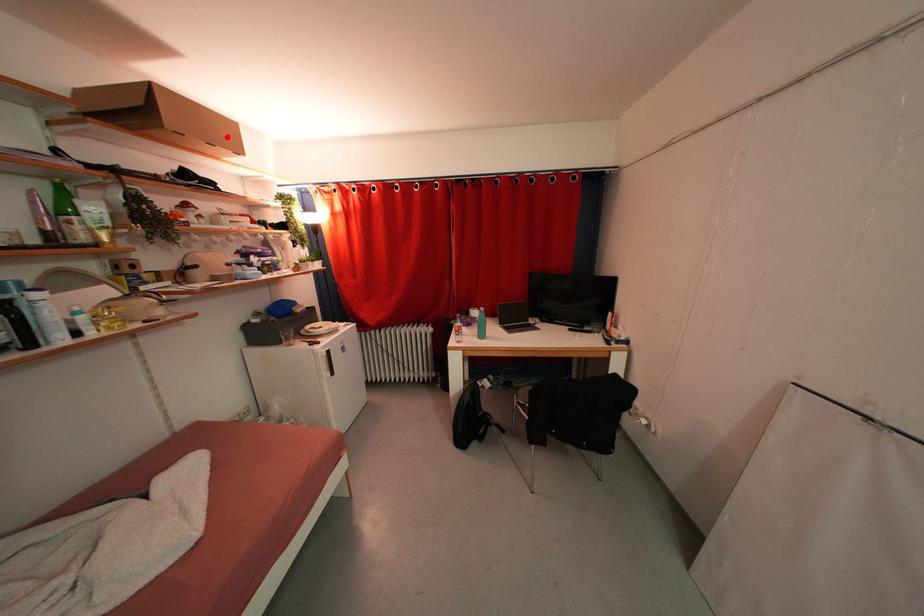
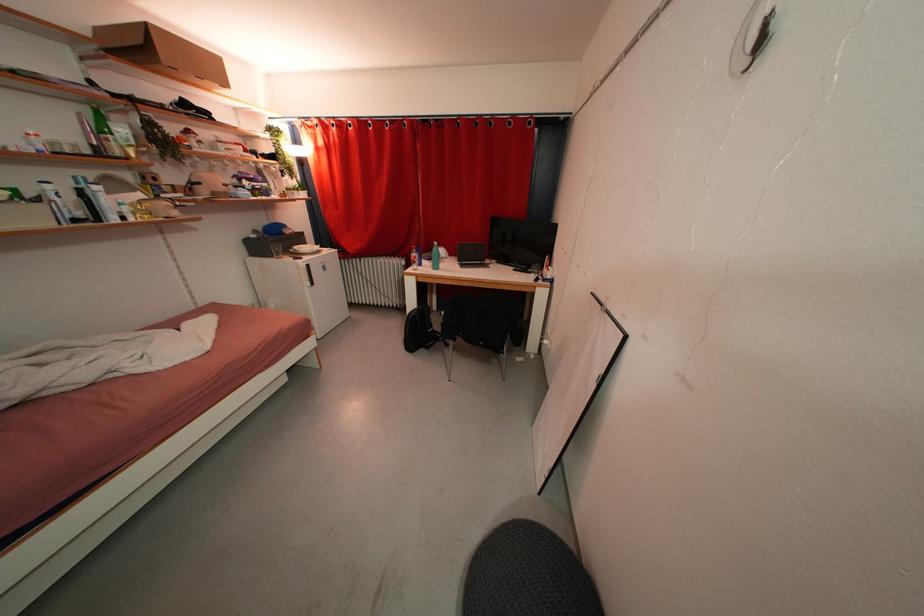
Question: I am providing you with two images of the same scene from different viewpoints. A red point is marked on the first image. Can you still see the location of the red point in image 2?

Choices:
 (A) Yes
 (B) No

Answer: (A)